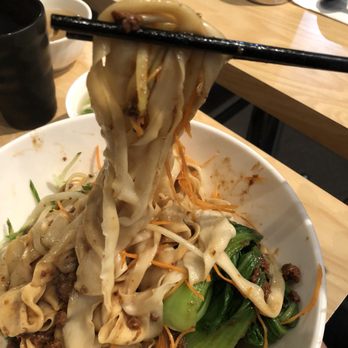
Find the location of a particular element. This screenshot has height=348, width=348. things found in a restaurant is located at coordinates [183, 224], [74, 87], [25, 85], [58, 50], [235, 25], [254, 50], [329, 209], [326, 107].